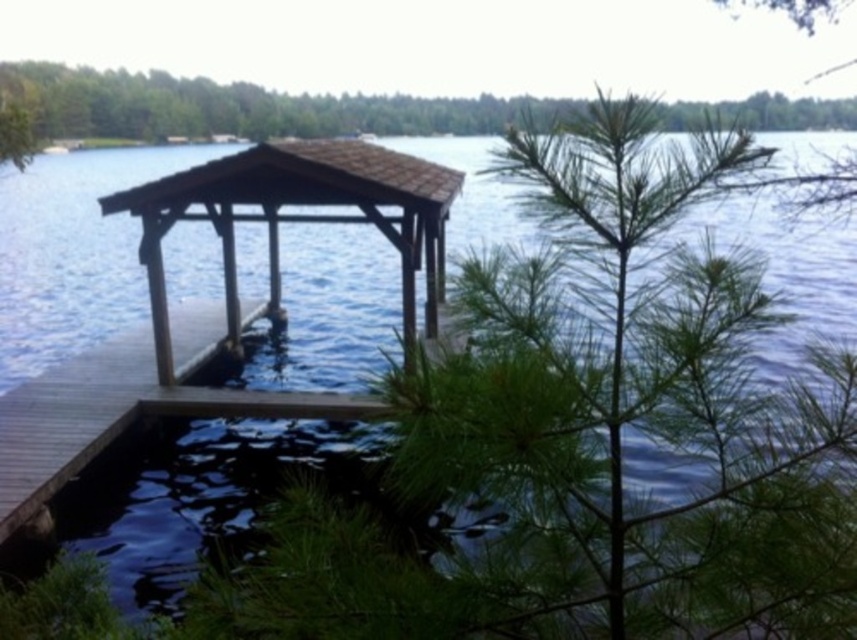
Question: Is brown wooden gazebo at center to the left of brown wooden dock at lower left from the viewer's perspective?

Choices:
 (A) no
 (B) yes

Answer: (A)

Question: Can you confirm if green needle-like tree at upper center is bigger than brown wooden dock at lower left?

Choices:
 (A) yes
 (B) no

Answer: (A)

Question: Which point is closer to the camera?

Choices:
 (A) green needle-like tree at upper center
 (B) brown wooden dock at lower left

Answer: (A)

Question: Which object appears farthest from the camera in this image?

Choices:
 (A) brown wooden dock at lower left
 (B) brown wooden gazebo at center

Answer: (B)

Question: Estimate the real-world distances between objects in this image. Which object is farther from the green needle-like tree at upper center?

Choices:
 (A) brown wooden gazebo at center
 (B) brown wooden dock at lower left

Answer: (A)

Question: Is green needle-like tree at upper center further to camera compared to brown wooden gazebo at center?

Choices:
 (A) yes
 (B) no

Answer: (B)